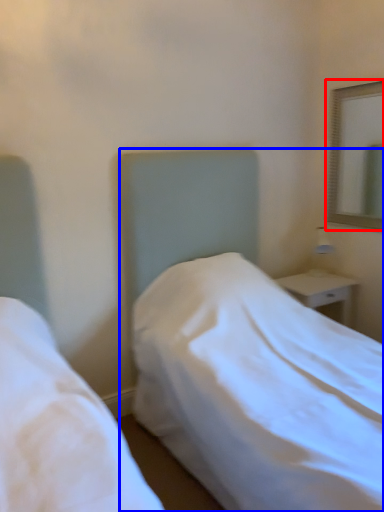
Question: Which object is further to the camera taking this photo, mirror (highlighted by a red box) or bed (highlighted by a blue box)?

Choices:
 (A) mirror
 (B) bed

Answer: (A)